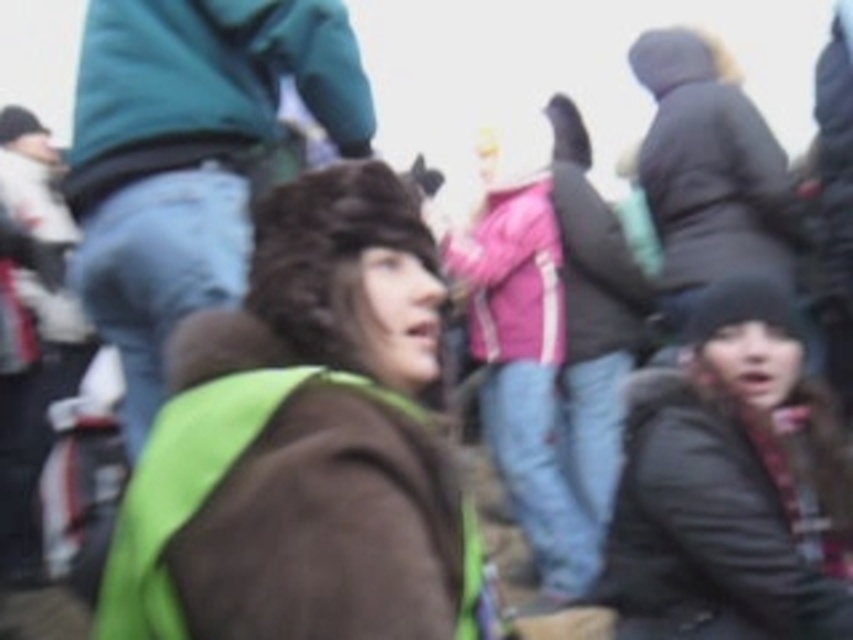
Question: Which point is farther to the camera?

Choices:
 (A) (198, 152)
 (B) (596, 355)

Answer: (B)

Question: Is green fabric vest at center behind matte pink jacket at center?

Choices:
 (A) no
 (B) yes

Answer: (A)

Question: Which object is the closest to the dark brown leather jacket at lower right?

Choices:
 (A) green fabric vest at center
 (B) matte pink jacket at center
 (C) pink fabric jacket at upper center

Answer: (A)

Question: Estimate the real-world distances between objects in this image. Which object is farther from the matte pink jacket at center?

Choices:
 (A) green fabric vest at center
 (B) teal fleece jacket at upper left

Answer: (A)

Question: Does teal fleece jacket at upper left have a larger size compared to dark brown leather jacket at lower right?

Choices:
 (A) yes
 (B) no

Answer: (B)

Question: Can you confirm if dark brown leather jacket at lower right is bigger than pink fabric jacket at upper center?

Choices:
 (A) no
 (B) yes

Answer: (A)